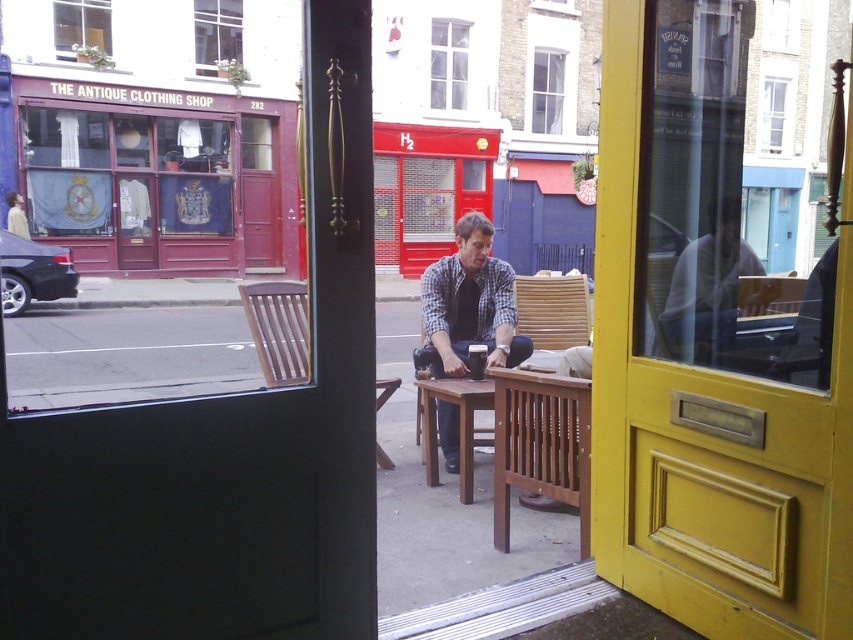
Question: Is red wood antique clothing shop at left further to camera compared to brown wooden table at center?

Choices:
 (A) no
 (B) yes

Answer: (B)

Question: Which point is farther from the camera taking this photo?

Choices:
 (A) (422, 288)
 (B) (22, 227)

Answer: (B)

Question: Which of the following is the farthest from the observer?

Choices:
 (A) checkered fabric shirt at center
 (B) brown wooden table at center
 (C) bamboo chair at center

Answer: (C)

Question: Is checkered fabric shirt at center to the right of brown wooden table at center from the viewer's perspective?

Choices:
 (A) no
 (B) yes

Answer: (B)

Question: Can you confirm if brown wooden chair at center is positioned above bamboo chair at center?

Choices:
 (A) no
 (B) yes

Answer: (A)

Question: Estimate the real-world distances between objects in this image. Which object is closer to the red wood antique clothing shop at left?

Choices:
 (A) light brown wooden chair at left
 (B) bamboo chair at center

Answer: (A)